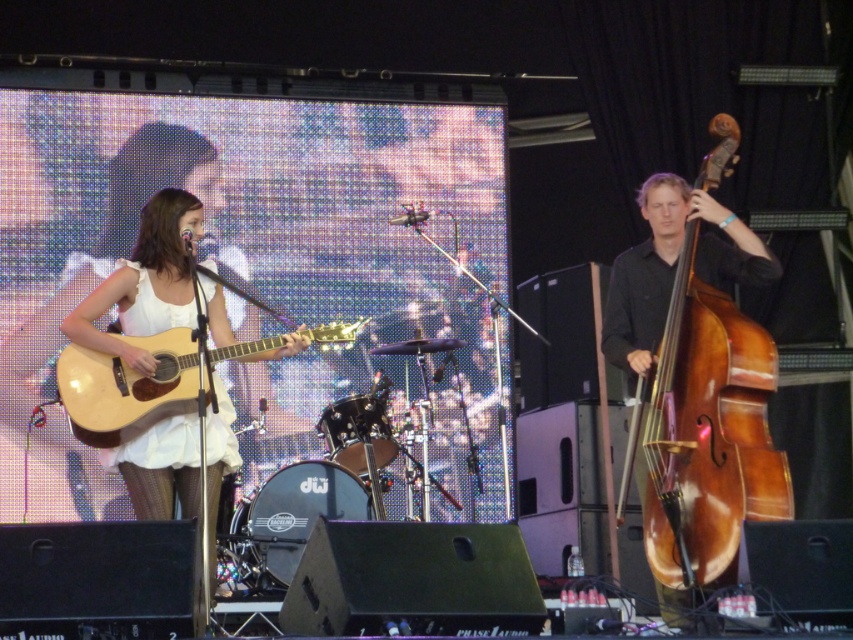
Question: Estimate the real-world distances between objects in this image. Which object is farther from the brown wooden cello at right?

Choices:
 (A) matte white dress at center
 (B) light brown wood acoustic guitar at center-left

Answer: (B)

Question: Does matte white dress at center have a greater width compared to light brown wood acoustic guitar at center-left?

Choices:
 (A) yes
 (B) no

Answer: (B)

Question: Which of these objects is positioned farthest from the brown wooden cello at right?

Choices:
 (A) matte white dress at center
 (B) light brown wood acoustic guitar at center-left

Answer: (B)

Question: Does brown wooden cello at right appear over matte white dress at center?

Choices:
 (A) no
 (B) yes

Answer: (A)

Question: Which object is farther from the camera taking this photo?

Choices:
 (A) light brown wood acoustic guitar at center-left
 (B) matte white dress at center
 (C) brown wooden cello at right

Answer: (B)

Question: Is matte white dress at center wider than light brown wood acoustic guitar at center-left?

Choices:
 (A) yes
 (B) no

Answer: (B)